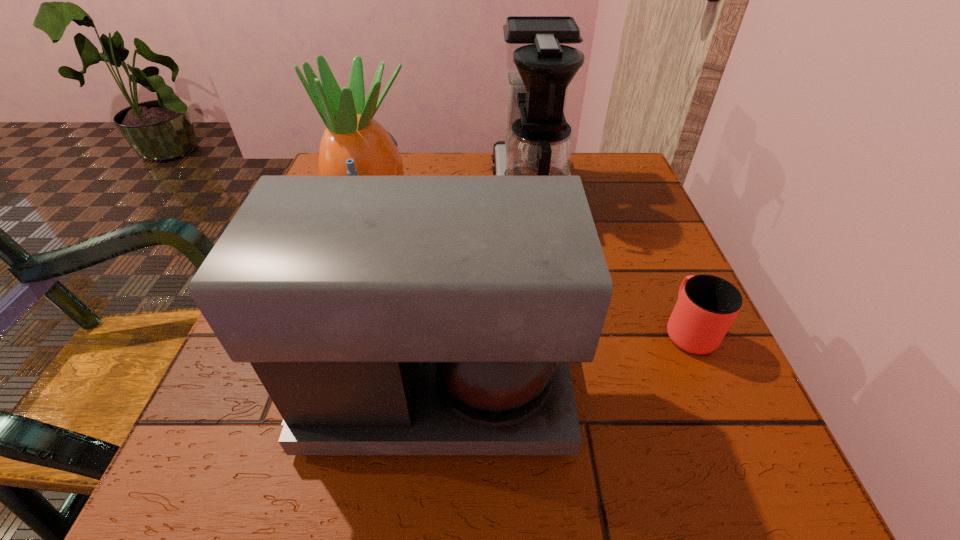
Where is `vacant position located on the handle side of the shortest object`? The height and width of the screenshot is (540, 960). vacant position located on the handle side of the shortest object is located at coordinates (647, 236).

Locate an element on the screen. The image size is (960, 540). free space located on the handle side of the shortest object is located at coordinates coord(655,253).

The width and height of the screenshot is (960, 540). Identify the location of free space located on the handle side of the shortest object. (636, 210).

Where is `coffee maker present at the far edge`? The image size is (960, 540). coffee maker present at the far edge is located at coordinates (542, 54).

Locate an element on the screen. pineapple that is at the far edge is located at coordinates (354, 143).

Where is `object that is at the near edge`? The width and height of the screenshot is (960, 540). object that is at the near edge is located at coordinates (384, 314).

The height and width of the screenshot is (540, 960). I want to click on pineapple that is at the left edge, so click(354, 143).

Locate an element on the screen. Image resolution: width=960 pixels, height=540 pixels. coffee maker that is at the left edge is located at coordinates (384, 314).

At what (x,y) coordinates should I click in order to perform the action: click on object positioned at the right edge. Please return your answer as a coordinate pair (x, y). Looking at the image, I should click on (707, 305).

Where is `object located at the far left corner`? The height and width of the screenshot is (540, 960). object located at the far left corner is located at coordinates (354, 143).